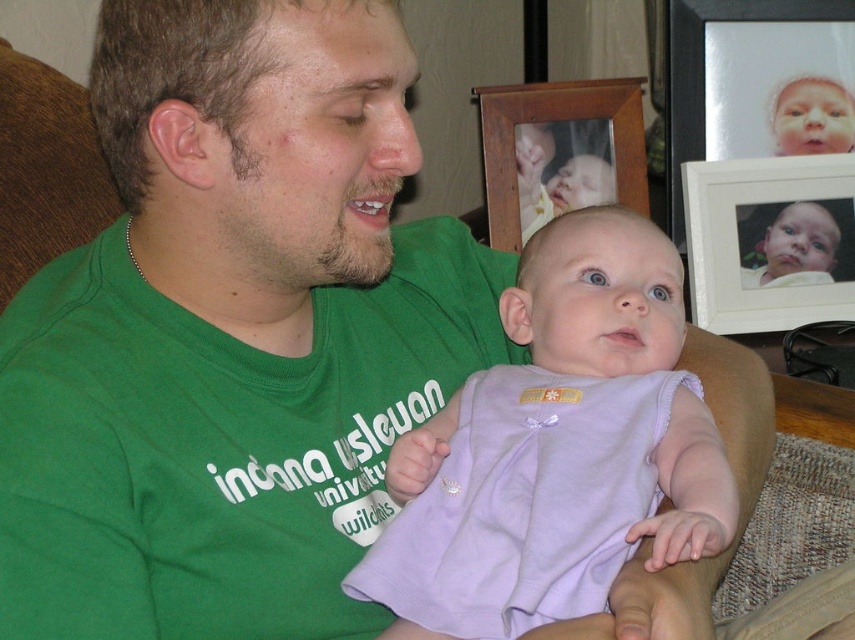
Question: Among these objects, which one is nearest to the camera?

Choices:
 (A) white matte picture frame at upper right
 (B) wooden picture frame at upper center
 (C) lavender fabric baby at center

Answer: (C)

Question: Is the position of white matte picture frame at upper right more distant than that of wooden picture frame at upper center?

Choices:
 (A) yes
 (B) no

Answer: (B)

Question: Can you confirm if lavender fabric baby at center is positioned to the left of white matte picture frame at upper right?

Choices:
 (A) no
 (B) yes

Answer: (B)

Question: Estimate the real-world distances between objects in this image. Which object is farther from the white matte picture frame at upper right?

Choices:
 (A) wooden picture frame at upper center
 (B) lavender fabric baby at center

Answer: (B)

Question: Which point is farther to the camera?

Choices:
 (A) lavender fabric baby at center
 (B) white matte picture frame at upper right

Answer: (B)

Question: Is lavender fabric baby at center closer to camera compared to wooden picture frame at upper center?

Choices:
 (A) yes
 (B) no

Answer: (A)